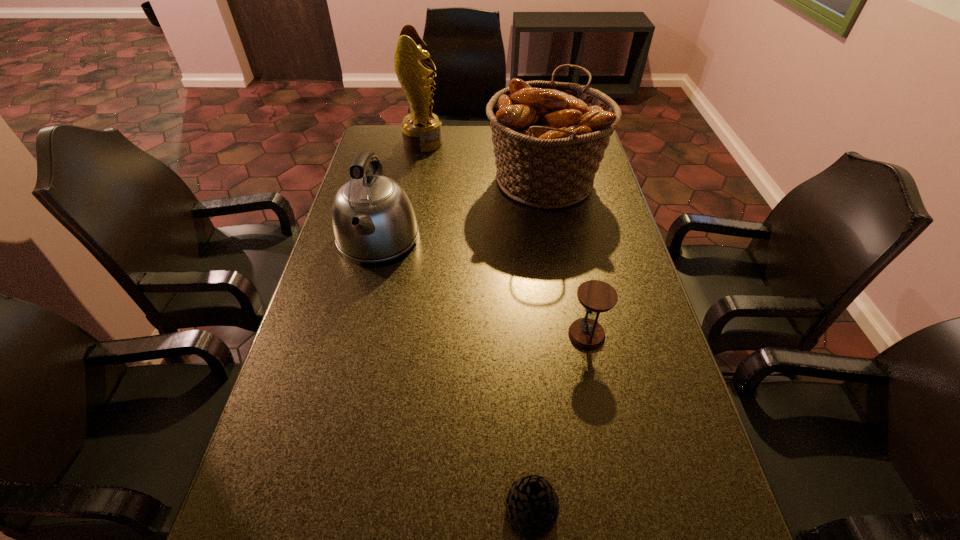
I want to click on free location located on the back of the second nearest object, so click(569, 250).

The image size is (960, 540). I want to click on free location located 0.110m at the narrow end of the shortest object, so click(444, 509).

Image resolution: width=960 pixels, height=540 pixels. Identify the location of vacant space located at the narrow end of the shortest object. (412, 509).

Find the location of a particular element. free space located 0.270m at the narrow end of the shortest object is located at coordinates (357, 509).

This screenshot has height=540, width=960. Find the location of `award at the far edge`. award at the far edge is located at coordinates (421, 129).

Locate an element on the screen. basket at the far edge is located at coordinates (549, 138).

Where is `award situated at the left edge`? The width and height of the screenshot is (960, 540). award situated at the left edge is located at coordinates (421, 129).

Find the location of a particular element. The height and width of the screenshot is (540, 960). kettle present at the left edge is located at coordinates (373, 219).

I want to click on basket at the right edge, so click(x=549, y=138).

The width and height of the screenshot is (960, 540). In order to click on hourglass present at the right edge in this screenshot , I will do `click(595, 296)`.